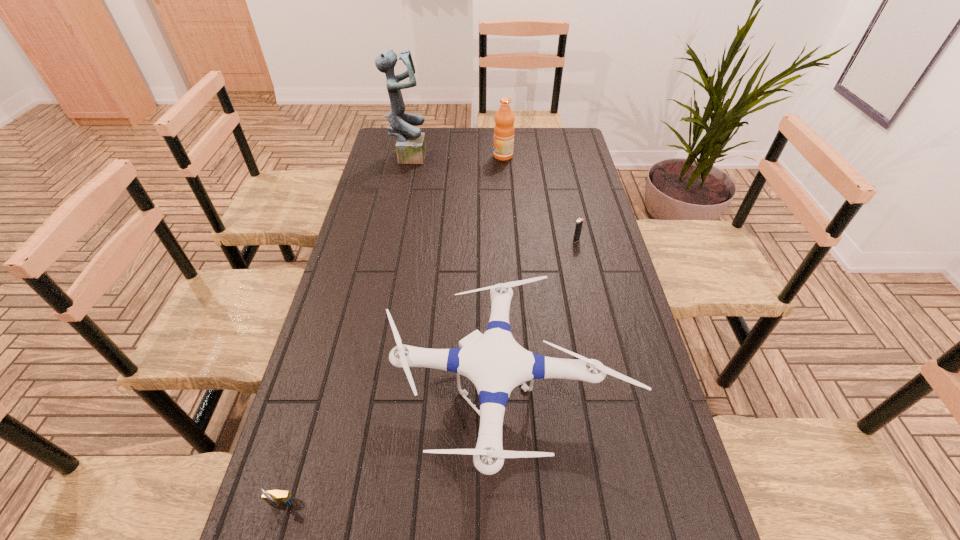
The image size is (960, 540). I want to click on free space that is in between the drone and the tallest object, so click(458, 273).

Locate an element on the screen. The width and height of the screenshot is (960, 540). free space between the fruit juice and the leftmost object is located at coordinates (393, 331).

I want to click on free space that is in between the padlock and the third farthest object, so click(429, 373).

This screenshot has height=540, width=960. Find the location of `free spot between the fruit juice and the third nearest object`. free spot between the fruit juice and the third nearest object is located at coordinates click(540, 198).

Identify the location of free spot between the drone and the igniter. The height and width of the screenshot is (540, 960). (541, 316).

Find the location of a particular element. The height and width of the screenshot is (540, 960). free area in between the padlock and the third tallest object is located at coordinates (395, 449).

At what (x,y) coordinates should I click in order to perform the action: click on blank region between the padlock and the second tallest object. Please return your answer as a coordinate pair (x, y). Image resolution: width=960 pixels, height=540 pixels. Looking at the image, I should click on (393, 331).

The width and height of the screenshot is (960, 540). Identify the location of free space between the third tallest object and the igniter. (541, 316).

Identify the location of vacant area that lies between the drone and the padlock. Image resolution: width=960 pixels, height=540 pixels. (395, 449).

At what (x,y) coordinates should I click in order to perform the action: click on free space between the igniter and the fruit juice. Please return your answer as a coordinate pair (x, y). This screenshot has width=960, height=540. Looking at the image, I should click on (540, 198).